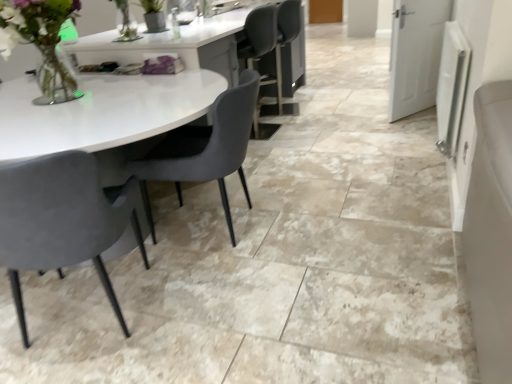
Question: Considering the relative sizes of matte gray chair at left, the second chair from the right, and translucent glass vase at upper left in the image provided, is matte gray chair at left, the second chair from the right, taller than translucent glass vase at upper left?

Choices:
 (A) no
 (B) yes

Answer: (B)

Question: Is matte gray chair at left, which is counted as the 1th chair, starting from the left, far away from translucent glass vase at upper left?

Choices:
 (A) yes
 (B) no

Answer: (B)

Question: Is matte gray chair at left, which is counted as the 1th chair, starting from the left, next to translucent glass vase at upper left?

Choices:
 (A) yes
 (B) no

Answer: (B)

Question: Is matte gray chair at left, which is counted as the 1th chair, starting from the left, bigger than translucent glass vase at upper left?

Choices:
 (A) yes
 (B) no

Answer: (A)

Question: From a real-world perspective, is matte gray chair at left, the second chair from the right, physically above translucent glass vase at upper left?

Choices:
 (A) yes
 (B) no

Answer: (B)

Question: Considering the positions of matte gray chair at left, which is counted as the 1th chair, starting from the left, and translucent glass vase at upper left in the image, is matte gray chair at left, which is counted as the 1th chair, starting from the left, wider or thinner than translucent glass vase at upper left?

Choices:
 (A) wide
 (B) thin

Answer: (A)

Question: From a real-world perspective, is matte gray chair at left, which is counted as the 1th chair, starting from the left, positioned above or below translucent glass vase at upper left?

Choices:
 (A) below
 (B) above

Answer: (A)

Question: Is matte gray chair at left, which is counted as the 1th chair, starting from the left, to the left or to the right of translucent glass vase at upper left in the image?

Choices:
 (A) left
 (B) right

Answer: (B)

Question: From the image's perspective, is matte gray chair at left, which is counted as the 1th chair, starting from the left, located above or below translucent glass vase at upper left?

Choices:
 (A) below
 (B) above

Answer: (A)

Question: Would you say velvet grey chair at center, which is the 1th chair from right to left, is inside or outside matte gray chair at left, which is counted as the 1th chair, starting from the left?

Choices:
 (A) outside
 (B) inside

Answer: (A)

Question: From their relative heights in the image, would you say velvet grey chair at center, which is the 1th chair from right to left, is taller or shorter than matte gray chair at left, which is counted as the 1th chair, starting from the left?

Choices:
 (A) tall
 (B) short

Answer: (B)

Question: Considering the positions of velvet grey chair at center, the 2th chair in the left-to-right sequence, and matte gray chair at left, which is counted as the 1th chair, starting from the left, in the image, is velvet grey chair at center, the 2th chair in the left-to-right sequence, wider or thinner than matte gray chair at left, which is counted as the 1th chair, starting from the left,?

Choices:
 (A) thin
 (B) wide

Answer: (B)

Question: Considering the relative positions of velvet grey chair at center, the 2th chair in the left-to-right sequence, and matte gray chair at left, the second chair from the right, in the image provided, is velvet grey chair at center, the 2th chair in the left-to-right sequence, to the left or to the right of matte gray chair at left, the second chair from the right,?

Choices:
 (A) right
 (B) left

Answer: (A)

Question: In terms of height, does matte gray chair at left, which is counted as the 1th chair, starting from the left, look taller or shorter compared to velvet grey chair at center, which is the 1th chair from right to left?

Choices:
 (A) tall
 (B) short

Answer: (A)

Question: Considering the positions of point (10, 183) and point (214, 124), is point (10, 183) closer or farther from the camera than point (214, 124)?

Choices:
 (A) farther
 (B) closer

Answer: (B)